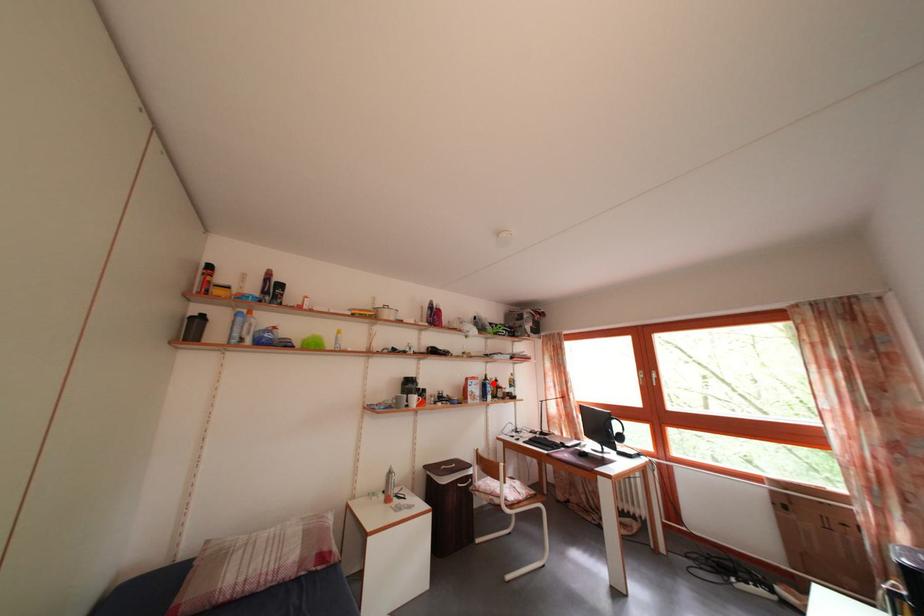
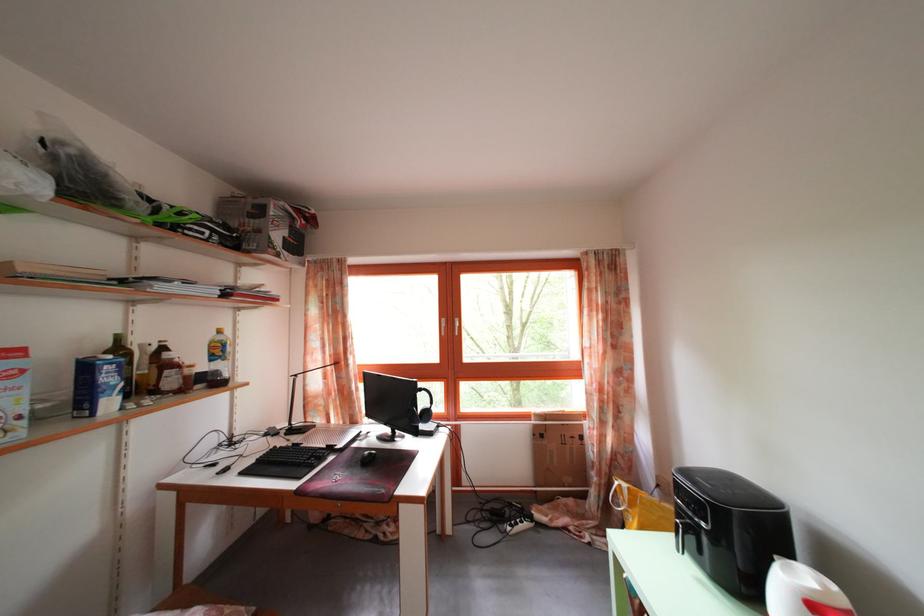
Question: A red point is marked in image1. In image2, is the corresponding 3D point closer to the camera or farther? Reply with the corresponding letter.

Choices:
 (A) The corresponding 3D point is closer.
 (B) The corresponding 3D point is farther.

Answer: (A)